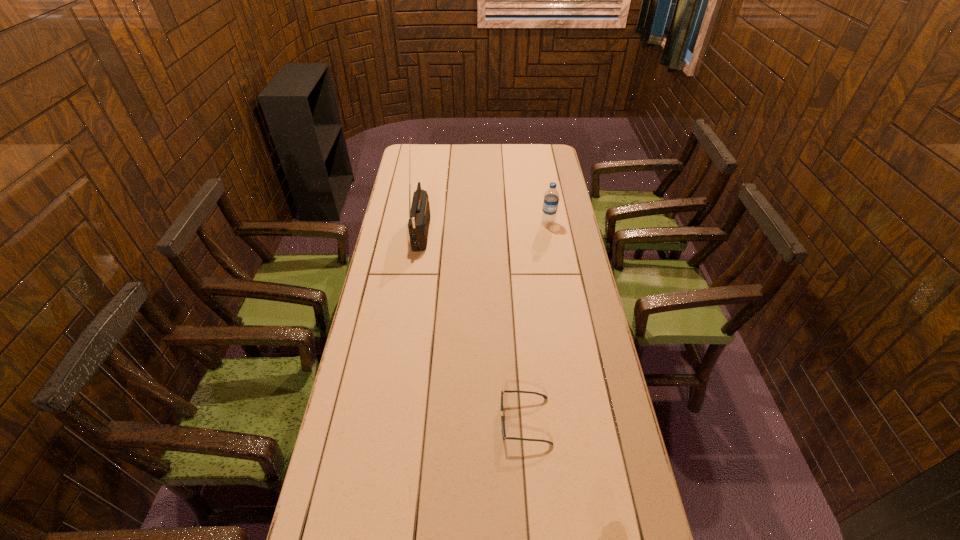
This screenshot has height=540, width=960. What are the coordinates of `vacant area located 0.300m on the face of the spectacles` in the screenshot? It's located at (393, 421).

The width and height of the screenshot is (960, 540). What are the coordinates of `object that is at the left edge` in the screenshot? It's located at (419, 216).

Image resolution: width=960 pixels, height=540 pixels. Identify the location of object that is at the right edge. (551, 198).

Locate an element on the screen. vacant position at the far edge of the desktop is located at coordinates (512, 156).

I want to click on free space at the left edge of the desktop, so pyautogui.click(x=382, y=488).

What are the coordinates of `free region at the right edge` in the screenshot? It's located at (582, 295).

Find the location of a particular element. This screenshot has height=540, width=960. vacant space in between the radio receiver and the water bottle is located at coordinates (485, 227).

Identify the location of vacant space that's between the rightmost object and the spectacles. This screenshot has width=960, height=540. (537, 322).

Image resolution: width=960 pixels, height=540 pixels. I want to click on blank region between the tallest object and the second object from left to right, so click(x=473, y=326).

Locate an element on the screen. This screenshot has height=540, width=960. vacant space that's between the leftmost object and the water bottle is located at coordinates (485, 227).